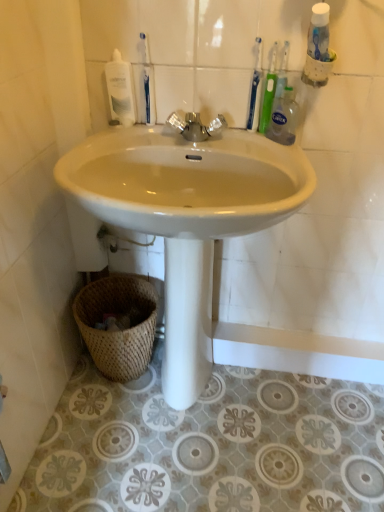
Where is `empty space that is in between silver metallic faucet at center and green plastic toothbrush at upper right, the 1th toothbrush when ordered from right to left`? The image size is (384, 512). empty space that is in between silver metallic faucet at center and green plastic toothbrush at upper right, the 1th toothbrush when ordered from right to left is located at coordinates (x=236, y=139).